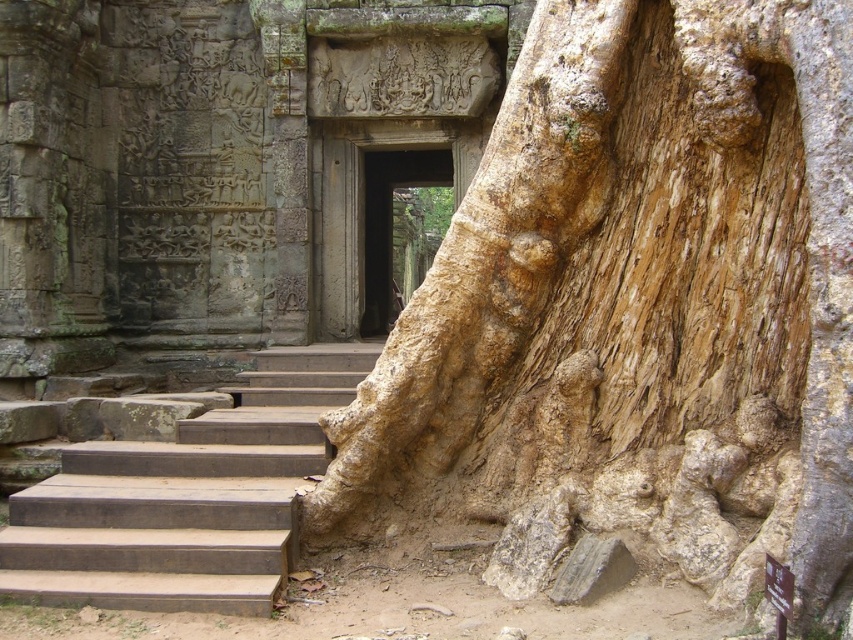
Based on the photo, does brown wooden stairs at center have a smaller size compared to brown stone door at center?

Incorrect, brown wooden stairs at center is not smaller in size than brown stone door at center.

Where is `brown wooden stairs at center`? brown wooden stairs at center is located at coordinates (184, 499).

Between light brown rough bark at center and brown wooden stairs at center, which one appears on the right side from the viewer's perspective?

Positioned to the right is light brown rough bark at center.

Is light brown rough bark at center closer to the viewer compared to brown wooden stairs at center?

Yes, it is.

Who is more forward, (601, 259) or (96, 512)?

Positioned in front is point (601, 259).

The image size is (853, 640). Identify the location of light brown rough bark at center. (592, 262).

Can you confirm if light brown rough bark at center is taller than brown stone door at center?

Yes.

Which is above, light brown rough bark at center or brown stone door at center?

brown stone door at center

Which is behind, point (578, 88) or point (386, 243)?

Point (386, 243)

Locate an element on the screen. light brown rough bark at center is located at coordinates (592, 262).